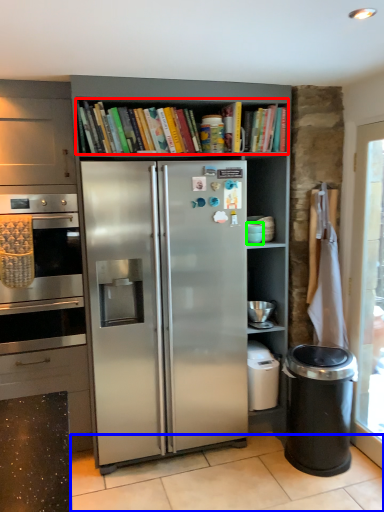
Question: Which object is positioned closest to shelf (highlighted by a red box)? Select from tile (highlighted by a blue box) and appliance (highlighted by a green box).

Choices:
 (A) tile
 (B) appliance

Answer: (B)